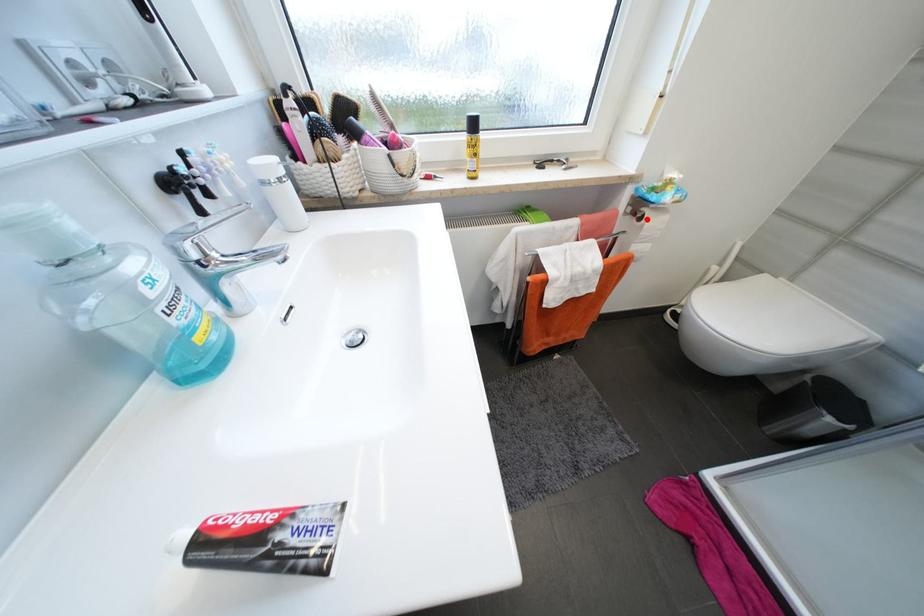
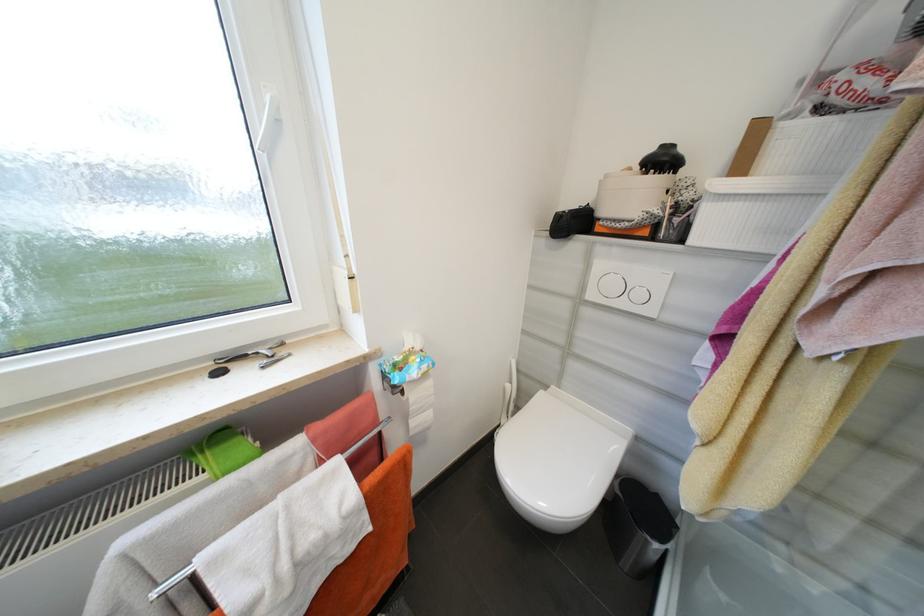
In the second image, find the point that corresponds to the highlighted location in the first image.

(407, 392)